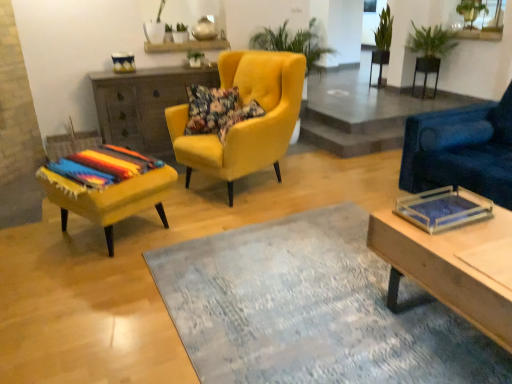
Question: Considering the positions of green leafy plant at upper right, the 1th plant from the left, and matte yellow ottoman at left, which ranks as the first chair in left-to-right order, in the image, is green leafy plant at upper right, the 1th plant from the left, wider or thinner than matte yellow ottoman at left, which ranks as the first chair in left-to-right order,?

Choices:
 (A) thin
 (B) wide

Answer: (A)

Question: Is green leafy plant at upper right, arranged as the 3th plant when viewed from the right, bigger or smaller than matte yellow ottoman at left, which ranks as the first chair in left-to-right order?

Choices:
 (A) big
 (B) small

Answer: (B)

Question: Which of these objects is positioned closest to the wooden rectangular tray at right?

Choices:
 (A) floral fabric pillow at center, which appears as the 1th pillow when viewed from the right
 (B) wooden cabinet at center
 (C) green leafy plant at upper right, acting as the 3th plant starting from the left
 (D) green leafy plant at upper right, which appears as the second plant when viewed from the right
 (E) matte yellow ottoman at left, the third chair from the right

Answer: (A)

Question: Estimate the real-world distances between objects in this image. Which object is farther from the velvet yellow armchair at center, the 2th chair from the right?

Choices:
 (A) green leafy plant at upper right, the 1th plant when ordered from right to left
 (B) green leafy plant at upper right, the 1th plant from the left
 (C) floral fabric pillow at center, the second pillow in the left-to-right sequence
 (D) matte yellow ottoman at left, the third chair from the right
 (E) velvet blue armchair at right, the 1th chair from the right

Answer: (B)